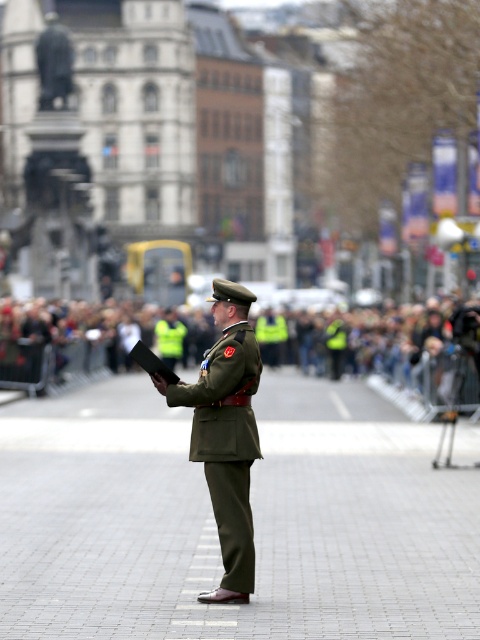
Question: Which of the following is the closest to the observer?

Choices:
 (A) matte olive green uniform at center
 (B) reflective yellow vests at center

Answer: (A)

Question: Does reflective yellow vests at center have a lesser width compared to green matte uniform at center?

Choices:
 (A) no
 (B) yes

Answer: (A)

Question: Among these points, which one is farthest from the camera?

Choices:
 (A) (464, 349)
 (B) (240, 499)
 (C) (179, 337)

Answer: (C)

Question: Among these objects, which one is farthest from the camera?

Choices:
 (A) matte olive green uniform at center
 (B) green matte uniform at center

Answer: (B)

Question: Does matte olive green uniform at center appear on the right side of green matte uniform at center?

Choices:
 (A) yes
 (B) no

Answer: (A)

Question: Can you confirm if matte olive green uniform at center is positioned to the left of green matte uniform at center?

Choices:
 (A) yes
 (B) no

Answer: (B)